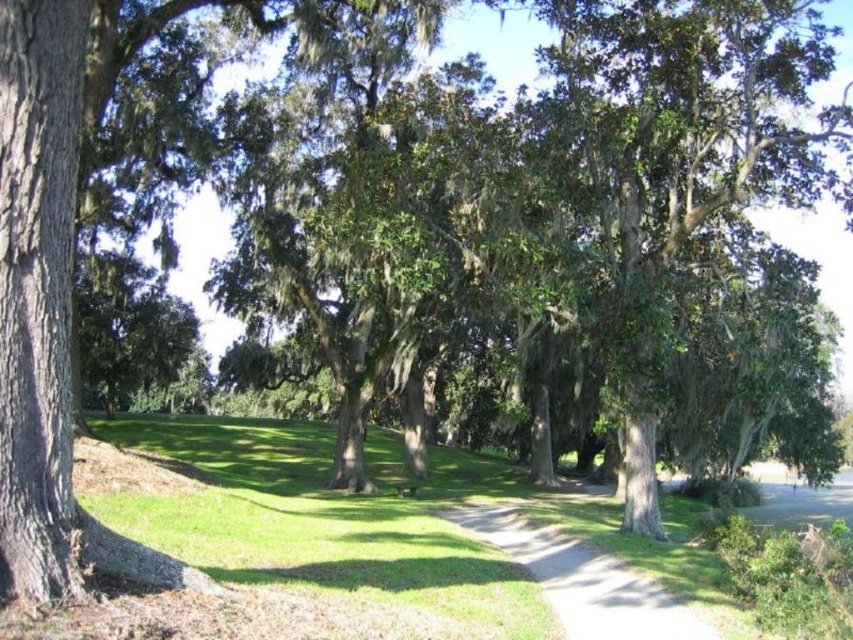
Question: Among these points, which one is nearest to the camera?

Choices:
 (A) (397, 493)
 (B) (670, 595)

Answer: (B)

Question: Which object is farther from the camera taking this photo?

Choices:
 (A) wooden park bench at center
 (B) smooth concrete path at center

Answer: (A)

Question: Does smooth concrete path at center appear over wooden park bench at center?

Choices:
 (A) no
 (B) yes

Answer: (B)

Question: From the image, what is the correct spatial relationship of smooth concrete path at center in relation to wooden park bench at center?

Choices:
 (A) above
 (B) below

Answer: (A)

Question: Which object is farther from the camera taking this photo?

Choices:
 (A) smooth concrete path at center
 (B) wooden park bench at center

Answer: (B)

Question: Does smooth concrete path at center have a lesser width compared to wooden park bench at center?

Choices:
 (A) no
 (B) yes

Answer: (A)